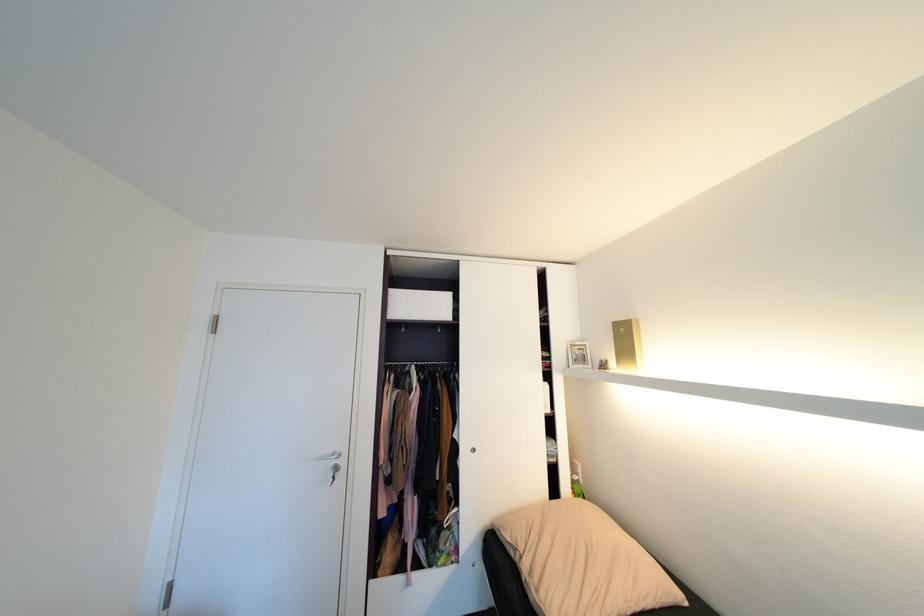
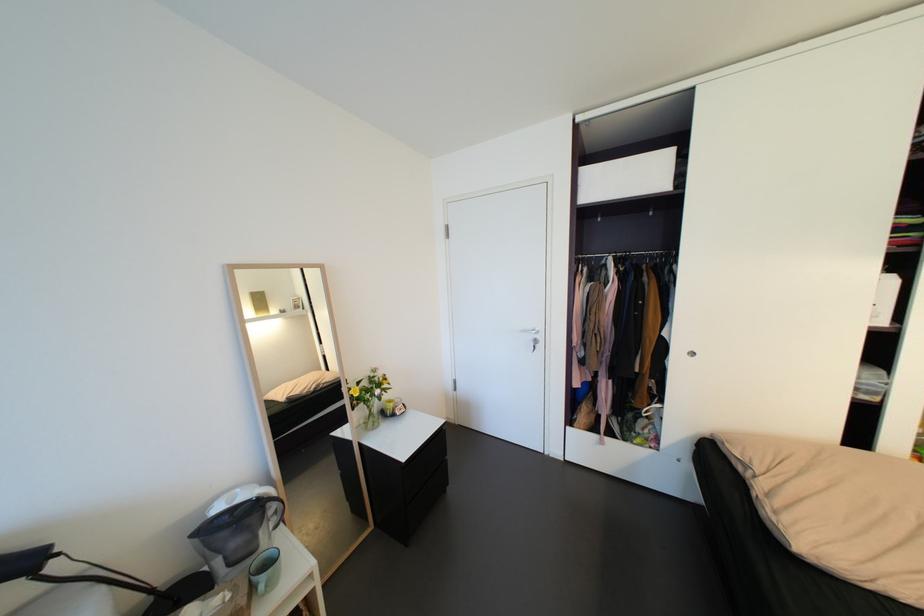
Where in the second image is the point corresponding to (x=348, y=475) from the first image?

(548, 346)